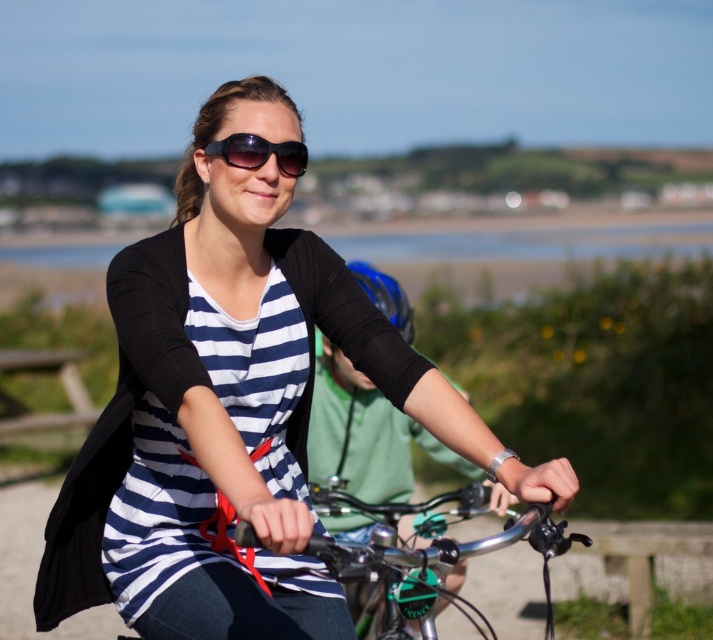
Question: Where is navy striped shirt at center located in relation to metallic silver bicycle handlebars at center in the image?

Choices:
 (A) below
 (B) above

Answer: (B)

Question: Is navy striped shirt at center to the left of sunglasses at center from the viewer's perspective?

Choices:
 (A) no
 (B) yes

Answer: (B)

Question: Which point is farther to the camera?

Choices:
 (A) (386, 358)
 (B) (381, 532)

Answer: (B)

Question: Which object is positioned farthest from the sunglasses at center?

Choices:
 (A) metallic silver bicycle handlebars at center
 (B) navy striped shirt at center

Answer: (A)

Question: Considering the real-world distances, which object is closest to the navy striped shirt at center?

Choices:
 (A) sunglasses at center
 (B) metallic silver bicycle handlebars at center

Answer: (A)

Question: Is navy striped shirt at center above metallic silver bicycle handlebars at center?

Choices:
 (A) yes
 (B) no

Answer: (A)